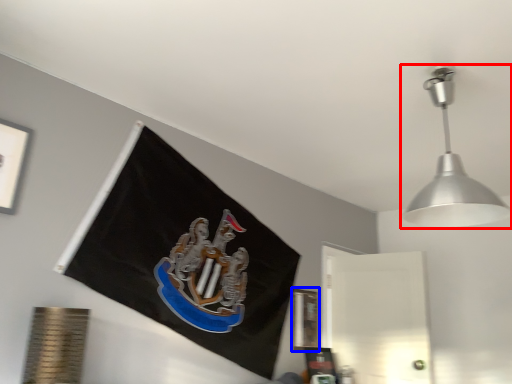
Question: Which object is closer to the camera taking this photo, lamp (highlighted by a red box) or picture frame (highlighted by a blue box)?

Choices:
 (A) lamp
 (B) picture frame

Answer: (A)